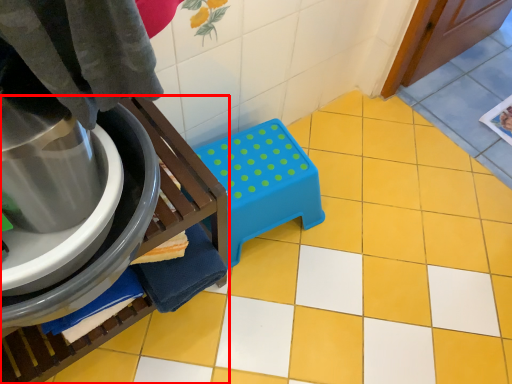
Question: From the image's perspective, where is furniture (annotated by the red box) located relative to step stool?

Choices:
 (A) above
 (B) below

Answer: (B)